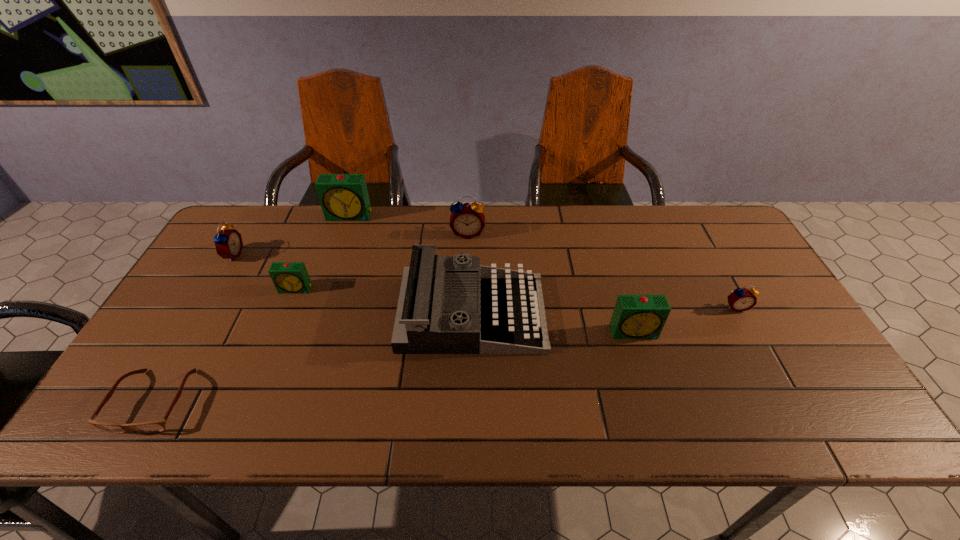
The image size is (960, 540). I want to click on the rightmost red alarm clock, so click(x=741, y=299).

You are a GUI agent. You are given a task and a screenshot of the screen. Output one action in this format:
    pyautogui.click(x=<x>, y=<y>)
    Task: Click on the second nearest green alarm clock
    
    Given the screenshot: What is the action you would take?
    pyautogui.click(x=288, y=277)

Find the location of a particular element. the smallest green alarm clock is located at coordinates coord(288,277).

Identify the location of spectacles. This screenshot has height=540, width=960. (154, 426).

Locate an element on the screen. The image size is (960, 540). the shortest object is located at coordinates (154, 426).

In order to click on vacant point located on the front-facing side of the second red alarm clock from right to left in this screenshot , I will do `click(466, 293)`.

This screenshot has height=540, width=960. I want to click on blank space located 0.180m on the front-facing side of the farthest alarm clock, so click(335, 258).

You are a GUI agent. You are given a task and a screenshot of the screen. Output one action in this format:
    pyautogui.click(x=<x>, y=<y>)
    Task: Click on the free space located 0.140m on the typing side of the black typewriter
    This screenshot has height=540, width=960.
    Given the screenshot: What is the action you would take?
    pyautogui.click(x=596, y=313)

Locate an element on the screen. The height and width of the screenshot is (540, 960). free region located 0.320m on the front-facing side of the second farthest red alarm clock is located at coordinates (346, 255).

Where is `free space located on the front-facing side of the nearest green alarm clock`? free space located on the front-facing side of the nearest green alarm clock is located at coordinates (660, 413).